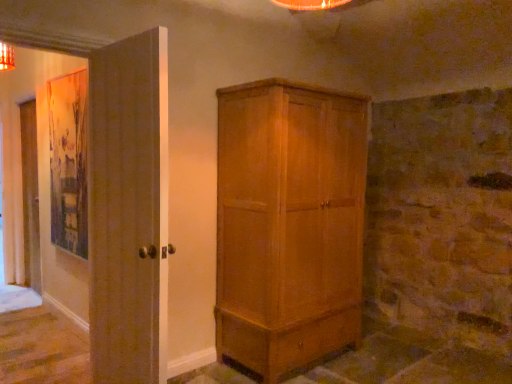
Where is `vacant space to the right of light brown wood cupboard at center`? vacant space to the right of light brown wood cupboard at center is located at coordinates (388, 360).